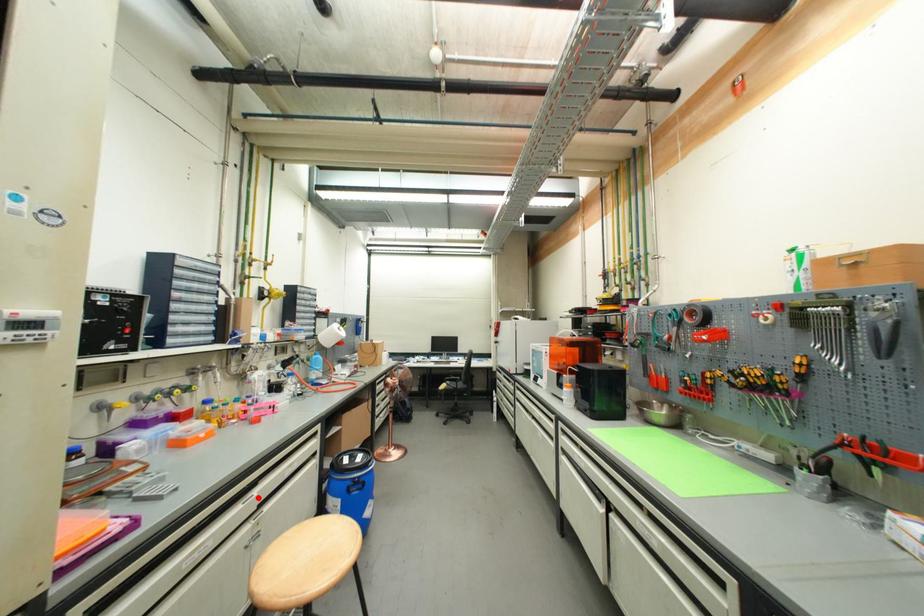
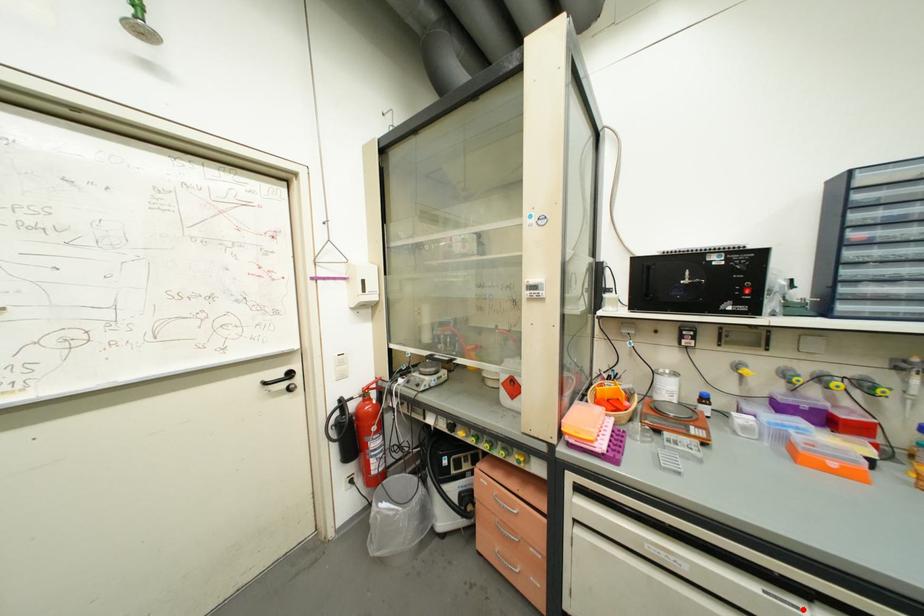
From the picture: I am providing you with two images of the same scene from different viewpoints. A red point is marked on the first image and another point is marked on the second image. Are the points marked in image1 and image2 representing the same 3D position?

Yes